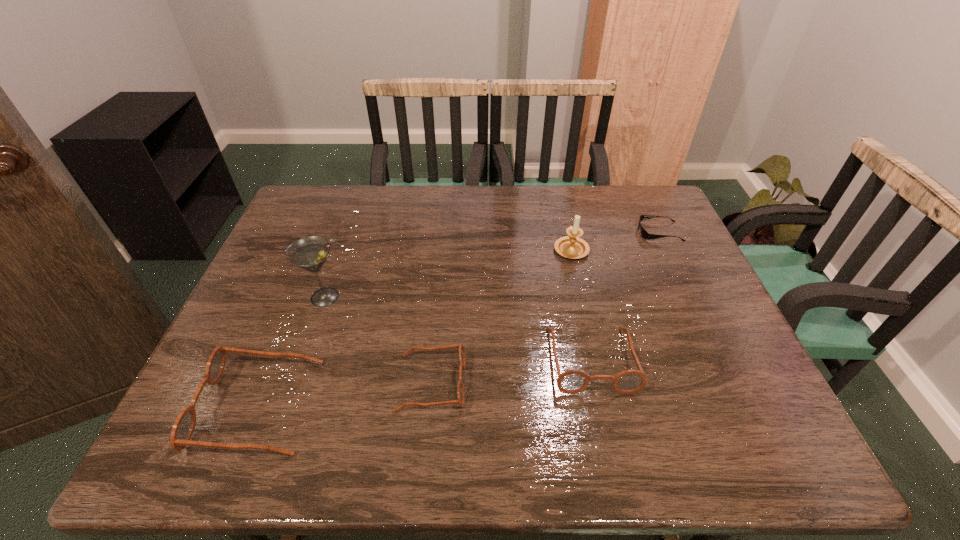
Observe the arrangement of all spectacless in the image. To keep them evenly spaced, where would you place another spectacles on the right? Please locate a free space. Please provide its 2D coordinates. Your answer should be formatted as a tuple, i.e. [(x, y)], where the tuple contains the x and y coordinates of a point satisfying the conditions above.

[(737, 339)]